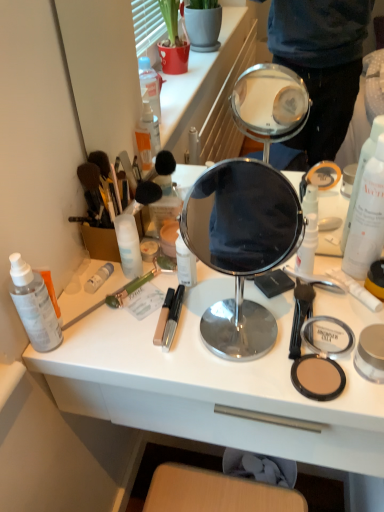
Question: From a real-world perspective, is translucent plastic spray bottle at left, which is the 2th toiletry in left-to-right order, under matte black compact at lower right?

Choices:
 (A) no
 (B) yes

Answer: (A)

Question: Is translucent plastic spray bottle at left, which is the 2th toiletry in left-to-right order, outside of matte black compact at lower right?

Choices:
 (A) yes
 (B) no

Answer: (A)

Question: Does translucent plastic spray bottle at left, which is the 2th toiletry in left-to-right order, appear on the left side of matte black compact at lower right?

Choices:
 (A) yes
 (B) no

Answer: (A)

Question: From a real-world perspective, does translucent plastic spray bottle at left, marked as the 5th toiletry in a right-to-left arrangement, stand above matte black compact at lower right?

Choices:
 (A) yes
 (B) no

Answer: (A)

Question: Does translucent plastic spray bottle at left, which is the 2th toiletry in left-to-right order, appear on the right side of matte black compact at lower right?

Choices:
 (A) yes
 (B) no

Answer: (B)

Question: Is translucent plastic spray bottle at left, marked as the 5th toiletry in a right-to-left arrangement, wider or thinner than matte yellow compact powder at right, placed as the 6th toiletry when sorted from left to right?

Choices:
 (A) wide
 (B) thin

Answer: (B)

Question: Considering the relative positions of translucent plastic spray bottle at left, which is the 2th toiletry in left-to-right order, and matte yellow compact powder at right, the first toiletry when ordered from right to left, in the image provided, is translucent plastic spray bottle at left, which is the 2th toiletry in left-to-right order, to the left or to the right of matte yellow compact powder at right, the first toiletry when ordered from right to left,?

Choices:
 (A) right
 (B) left

Answer: (B)

Question: From a real-world perspective, is translucent plastic spray bottle at left, marked as the 5th toiletry in a right-to-left arrangement, physically located above or below matte yellow compact powder at right, the first toiletry when ordered from right to left?

Choices:
 (A) below
 (B) above

Answer: (B)

Question: Considering the positions of translucent plastic spray bottle at left, marked as the 5th toiletry in a right-to-left arrangement, and matte yellow compact powder at right, the first toiletry when ordered from right to left, in the image, is translucent plastic spray bottle at left, marked as the 5th toiletry in a right-to-left arrangement, taller or shorter than matte yellow compact powder at right, the first toiletry when ordered from right to left,?

Choices:
 (A) short
 (B) tall

Answer: (B)

Question: From a real-world perspective, is white matte tube at left, the 4th toiletry when ordered from right to left, above or below translucent plastic spray bottle at left, which is the 2th toiletry in left-to-right order?

Choices:
 (A) below
 (B) above

Answer: (A)

Question: From the image's perspective, relative to translucent plastic spray bottle at left, which is the 2th toiletry in left-to-right order, is white matte tube at left, the 4th toiletry when ordered from right to left, above or below?

Choices:
 (A) above
 (B) below

Answer: (A)

Question: Does point (100, 272) appear closer or farther from the camera than point (54, 298)?

Choices:
 (A) farther
 (B) closer

Answer: (A)

Question: Do you think white matte tube at left, the 4th toiletry when ordered from right to left, is within translucent plastic spray bottle at left, marked as the 5th toiletry in a right-to-left arrangement, or outside of it?

Choices:
 (A) inside
 (B) outside

Answer: (B)

Question: Relative to polished silver mirror at center, is translucent plastic spray bottle at left, marked as the 5th toiletry in a right-to-left arrangement, in front or behind?

Choices:
 (A) front
 (B) behind

Answer: (B)

Question: From the image's perspective, relative to polished silver mirror at center, is translucent plastic spray bottle at left, which is the 2th toiletry in left-to-right order, above or below?

Choices:
 (A) above
 (B) below

Answer: (B)